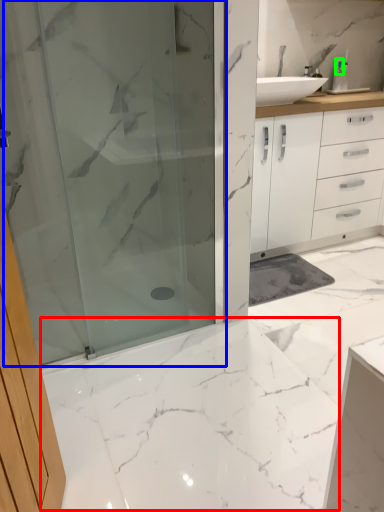
Question: Estimate the real-world distances between objects in this image. Which object is closer to marble (highlighted by a red box), shower door (highlighted by a blue box) or toiletry (highlighted by a green box)?

Choices:
 (A) shower door
 (B) toiletry

Answer: (A)